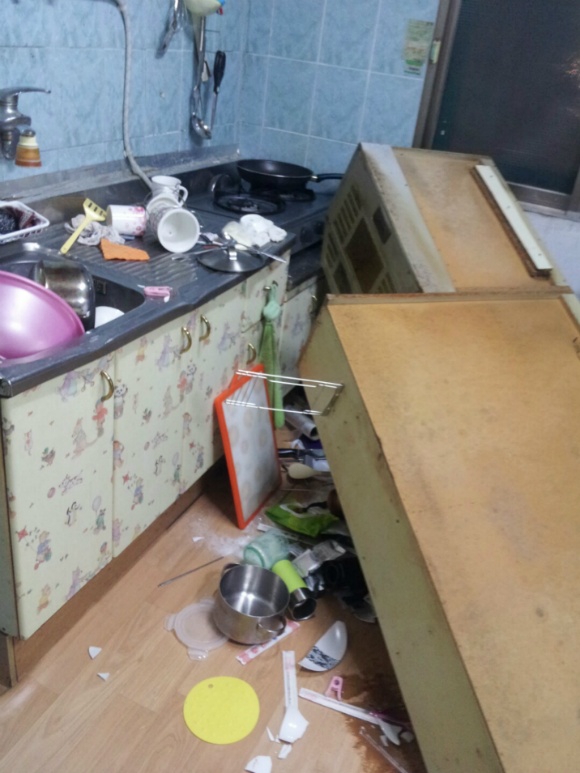
Locate an element on the screen. This screenshot has height=773, width=580. stove burner is located at coordinates (241, 202).